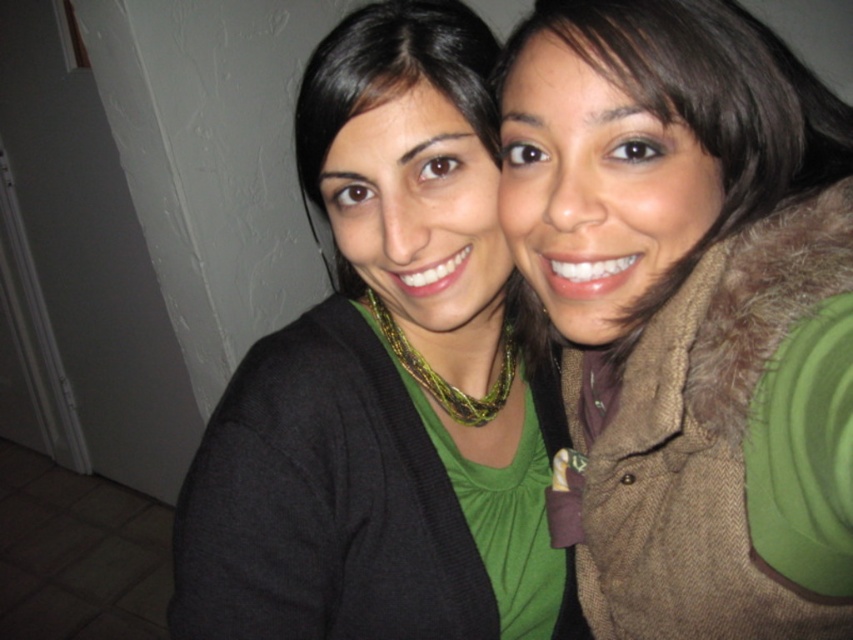
Question: Which object appears farthest from the camera in this image?

Choices:
 (A) black matte cardigan at center
 (B) green fuzzy vest at upper right

Answer: (A)

Question: Is green fuzzy vest at upper right closer to camera compared to black matte cardigan at center?

Choices:
 (A) yes
 (B) no

Answer: (A)

Question: Does green fuzzy vest at upper right appear over black matte cardigan at center?

Choices:
 (A) no
 (B) yes

Answer: (B)

Question: Is green fuzzy vest at upper right below black matte cardigan at center?

Choices:
 (A) yes
 (B) no

Answer: (B)

Question: Which object appears farthest from the camera in this image?

Choices:
 (A) green fuzzy vest at upper right
 (B) black matte cardigan at center

Answer: (B)